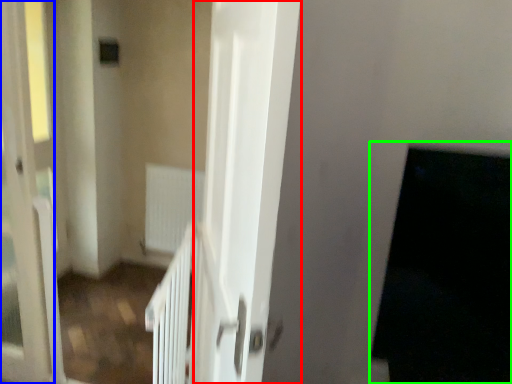
Question: Which object is positioned closest to screen door (highlighted by a red box)? Select from screen door (highlighted by a blue box) and dark (highlighted by a green box).

Choices:
 (A) screen door
 (B) dark

Answer: (B)